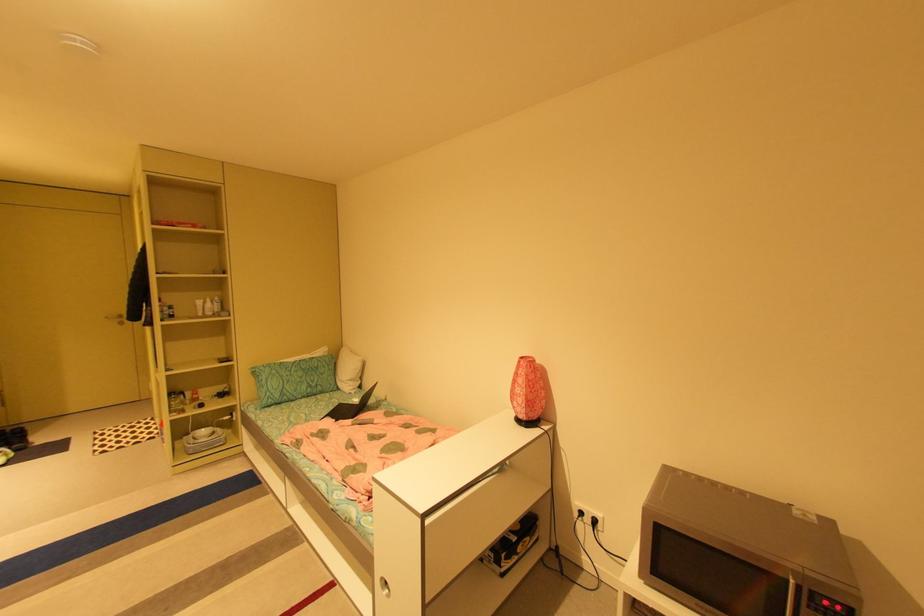
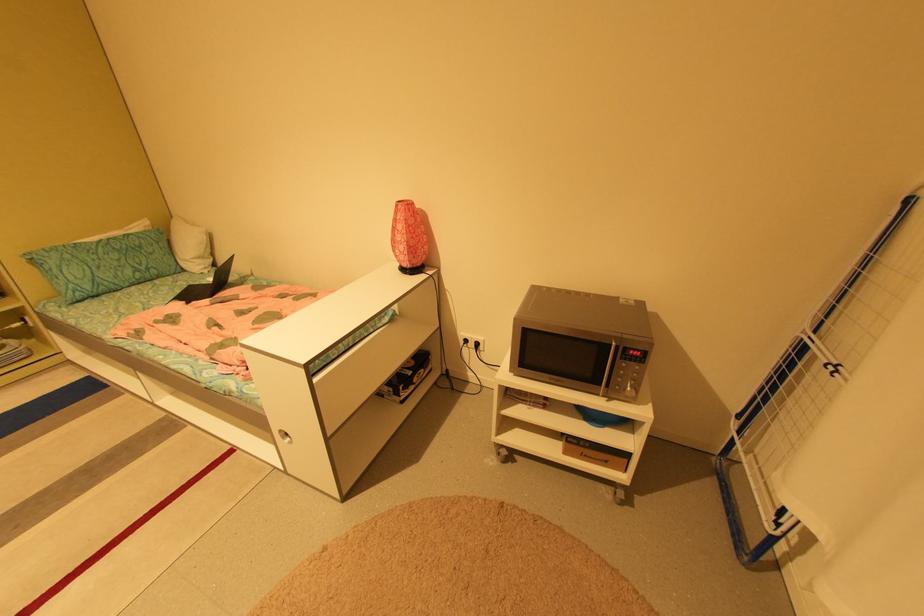
In the second image, find the point that corresponds to the point at 356,403 in the first image.

(210, 284)